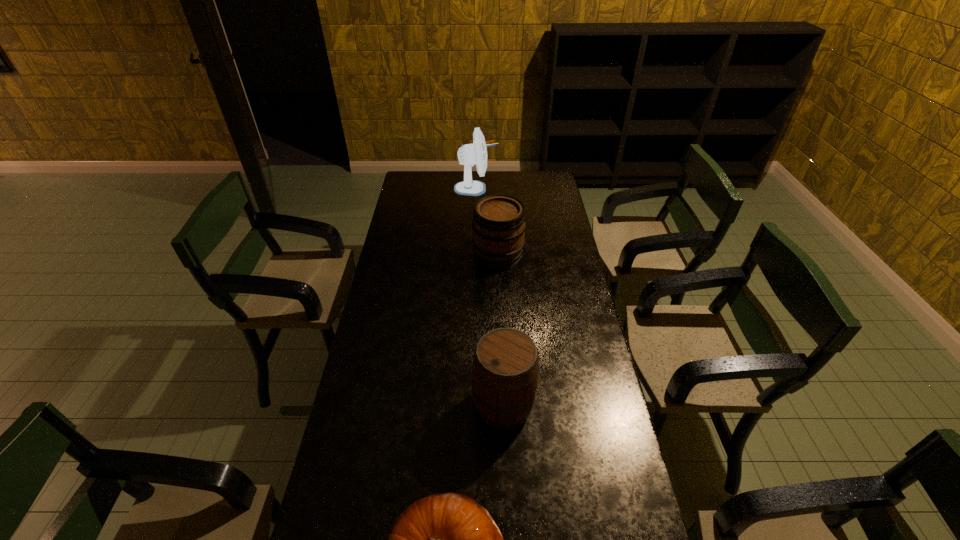
At what (x,y) coordinates should I click in order to perform the action: click on free space that satisfies the following two spatial constraints: 1. on the grille of the farthest object; 2. on the right side of the third nearest object. Please return your answer as a coordinate pair (x, y). Image resolution: width=960 pixels, height=540 pixels. Looking at the image, I should click on (475, 255).

Find the location of a particular element. This screenshot has width=960, height=540. free space that satisfies the following two spatial constraints: 1. on the grille of the fan; 2. on the left side of the nearer cider is located at coordinates (473, 405).

Locate an element on the screen. vacant position in the image that satisfies the following two spatial constraints: 1. on the back side of the nearer cider; 2. on the right side of the farther cider is located at coordinates (496, 255).